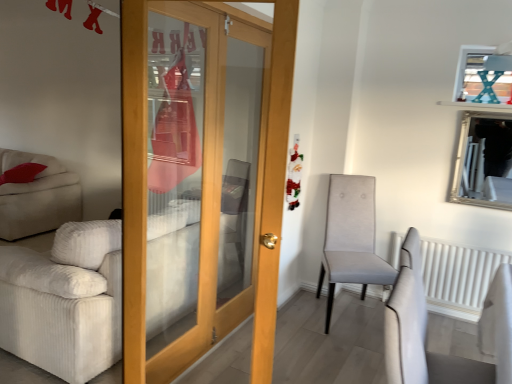
Question: Considering their positions, is white textured radiator at right located in front of or behind wooden door at center?

Choices:
 (A) front
 (B) behind

Answer: (B)

Question: Choose the correct answer: Is white textured radiator at right inside wooden door at center or outside it?

Choices:
 (A) inside
 (B) outside

Answer: (B)

Question: Which of these objects is positioned farthest from the wooden door at center?

Choices:
 (A) silver/glass mirror at upper right
 (B) light gray fabric chair at center-right
 (C) white corduroy couch at left
 (D) white textured radiator at right

Answer: (A)

Question: Based on their relative distances, which object is nearer to the wooden door at center?

Choices:
 (A) light gray fabric chair at center-right
 (B) silver/glass mirror at upper right
 (C) white textured radiator at right
 (D) white corduroy couch at left

Answer: (D)